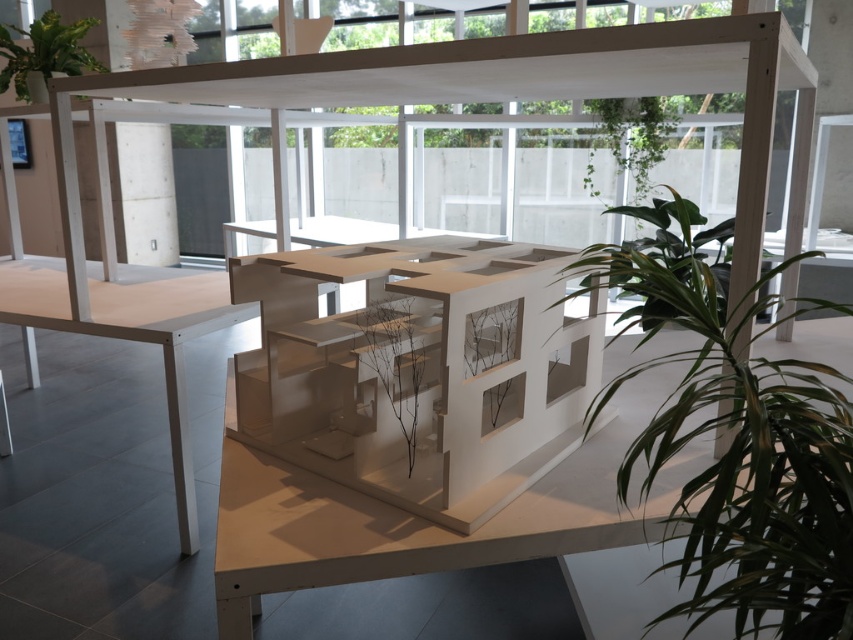
Question: Which object appears closest to the camera in this image?

Choices:
 (A) green matte plant at upper left
 (B) green leafy plant at upper right
 (C) green leafy plant at center

Answer: (C)

Question: Estimate the real-world distances between objects in this image. Which object is farther from the brown matte plant at center?

Choices:
 (A) green matte plant at upper left
 (B) green leafy plant at center
 (C) green leafy plant at upper right

Answer: (C)

Question: Does green leafy plant at upper right lie in front of green matte plant at upper left?

Choices:
 (A) yes
 (B) no

Answer: (B)

Question: Can you confirm if green leafy plant at upper right is positioned to the left of green matte plant at upper left?

Choices:
 (A) no
 (B) yes

Answer: (A)

Question: Which point appears closest to the camera in this image?

Choices:
 (A) (73, 29)
 (B) (616, 140)
 (C) (828, 467)
 (D) (412, 316)

Answer: (C)

Question: Is green leafy plant at center smaller than green matte plant at upper left?

Choices:
 (A) yes
 (B) no

Answer: (B)